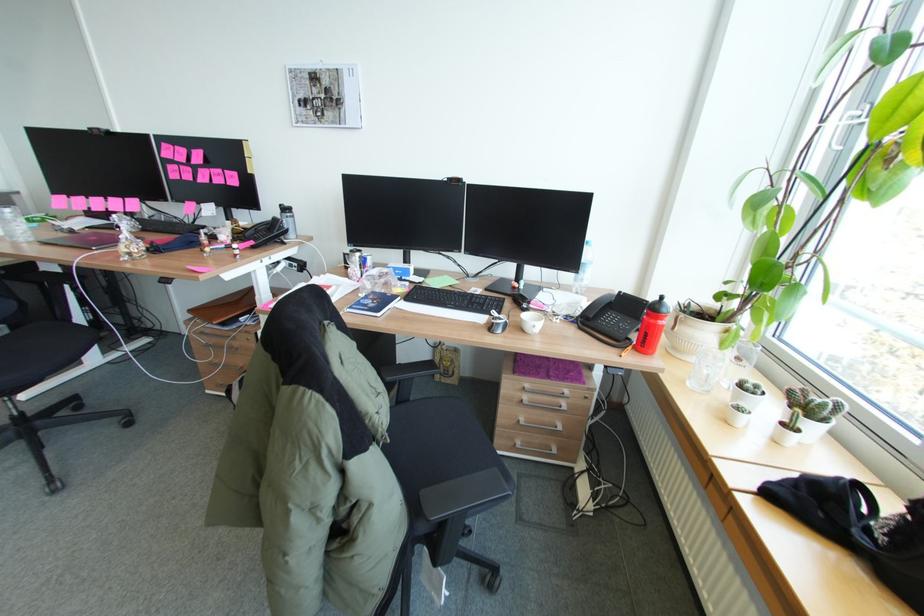
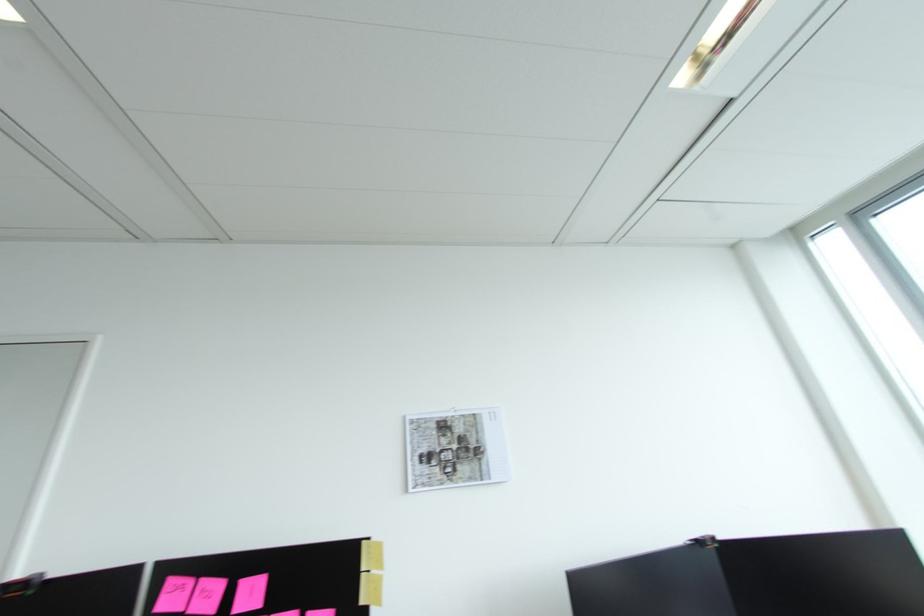
The point at [169,146] is marked in the first image. Where is the corresponding point in the second image?

(176, 582)